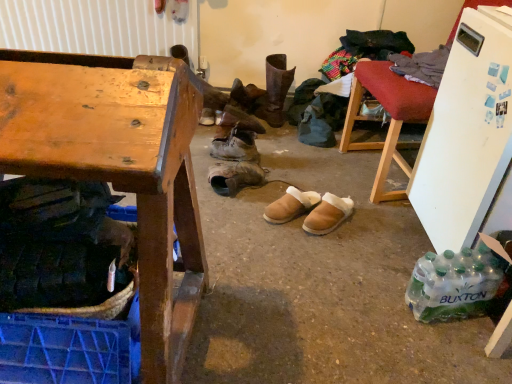
Question: Is wooden desk at left in front of or behind leather boots at center, which is the third footwear in bottom-to-top order, in the image?

Choices:
 (A) front
 (B) behind

Answer: (A)

Question: Considering the positions of point (193, 172) and point (233, 172), is point (193, 172) closer or farther from the camera than point (233, 172)?

Choices:
 (A) closer
 (B) farther

Answer: (A)

Question: Considering the real-world distances, which object is closest to the leather boot at center, which ranks as the 1th footwear in top-to-bottom order?

Choices:
 (A) leather boots at center, the second footwear viewed from the top
 (B) wooden chair at upper right
 (C) clear plastic bottles at lower right
 (D) brown suede slippers at center, which is counted as the 4th footwear, starting from the top
 (E) wooden desk at left

Answer: (A)

Question: Which object is positioned closest to the brown suede slippers at center, the first footwear in the bottom-to-top sequence?

Choices:
 (A) leather boot at center, which is the fifth footwear from bottom to top
 (B) wooden chair at upper right
 (C) leather boots at center, placed as the fourth footwear when sorted from bottom to top
 (D) clear plastic bottles at lower right
 (E) leather boots at center, which is the third footwear in bottom-to-top order

Answer: (E)